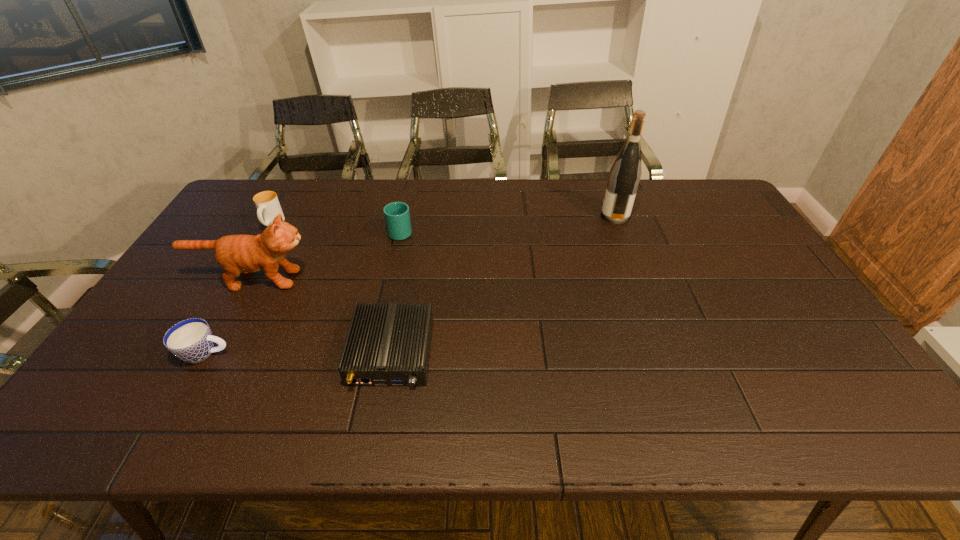
The height and width of the screenshot is (540, 960). I want to click on wine bottle, so click(625, 173).

Locate an element on the screen. The height and width of the screenshot is (540, 960). the tallest object is located at coordinates (625, 173).

Identify the location of the second tallest object. (236, 254).

This screenshot has width=960, height=540. I want to click on the third nearest object, so click(x=236, y=254).

Identify the location of the rightmost cup. (397, 216).

The width and height of the screenshot is (960, 540). I want to click on the nearest cup, so click(191, 340).

Locate an element on the screen. Image resolution: width=960 pixels, height=540 pixels. router is located at coordinates (386, 345).

You are a GUI agent. You are given a task and a screenshot of the screen. Output one action in this format:
    pyautogui.click(x=<x>, y=<y>)
    Task: Click on the free point located on the left of the rightmost object
    
    Given the screenshot: What is the action you would take?
    pyautogui.click(x=587, y=216)

You are a GUI agent. You are given a task and a screenshot of the screen. Output one action in this format:
    pyautogui.click(x=<x>, y=<y>)
    Task: Click on the vacant region located on the face of the fourth farthest object
    This screenshot has width=960, height=540.
    Given the screenshot: What is the action you would take?
    pyautogui.click(x=409, y=279)

This screenshot has height=540, width=960. Identify the location of vacant position located 0.230m on the handle side of the rightmost cup. (410, 186).